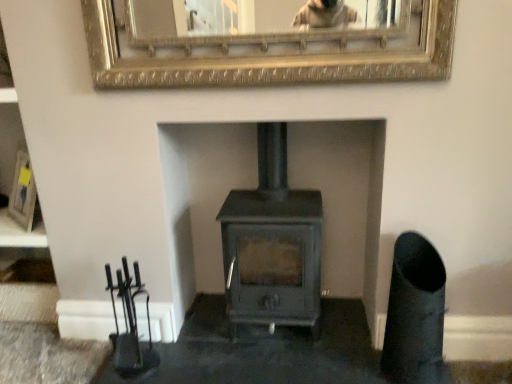
Question: Does matte black picture frame at left, the 2th picture frame positioned from the front, have a larger size compared to gold textured mirror at upper center, marked as the second picture frame in a back-to-front arrangement?

Choices:
 (A) yes
 (B) no

Answer: (B)

Question: Is matte black picture frame at left, the 2th picture frame positioned from the right, oriented towards gold textured mirror at upper center, the 2th picture frame from the left?

Choices:
 (A) no
 (B) yes

Answer: (A)

Question: From a real-world perspective, is matte black picture frame at left, the 2th picture frame positioned from the right, under gold textured mirror at upper center, the second picture frame ordered from the bottom?

Choices:
 (A) yes
 (B) no

Answer: (A)

Question: Is matte black picture frame at left, placed as the 2th picture frame when sorted from top to bottom, beside gold textured mirror at upper center, the second picture frame ordered from the bottom?

Choices:
 (A) yes
 (B) no

Answer: (B)

Question: Does matte black picture frame at left, the 2th picture frame positioned from the front, have a lesser width compared to gold textured mirror at upper center, the first picture frame viewed from the top?

Choices:
 (A) yes
 (B) no

Answer: (B)

Question: Considering the positions of matte black picture frame at left, the first picture frame in the left-to-right sequence, and gold textured mirror at upper center, which is the first picture frame from front to back, in the image, is matte black picture frame at left, the first picture frame in the left-to-right sequence, taller or shorter than gold textured mirror at upper center, which is the first picture frame from front to back,?

Choices:
 (A) short
 (B) tall

Answer: (B)

Question: Looking at their shapes, would you say matte black picture frame at left, which ranks as the 1th picture frame in back-to-front order, is wider or thinner than gold textured mirror at upper center, the first picture frame viewed from the top?

Choices:
 (A) wide
 (B) thin

Answer: (A)

Question: From a real-world perspective, is matte black picture frame at left, the first picture frame in the left-to-right sequence, positioned above or below gold textured mirror at upper center, the second picture frame ordered from the bottom?

Choices:
 (A) above
 (B) below

Answer: (B)

Question: Is matte black picture frame at left, which ranks as the 1th picture frame in back-to-front order, spatially inside gold textured mirror at upper center, which is the first picture frame from front to back, or outside of it?

Choices:
 (A) inside
 (B) outside

Answer: (B)

Question: Choose the correct answer: Is gold textured mirror at upper center, the second picture frame ordered from the bottom, inside matte black picture frame at left, the 2th picture frame positioned from the front, or outside it?

Choices:
 (A) outside
 (B) inside

Answer: (A)

Question: Is point (218, 56) closer or farther from the camera than point (25, 187)?

Choices:
 (A) farther
 (B) closer

Answer: (B)

Question: From a real-world perspective, is gold textured mirror at upper center, the first picture frame viewed from the top, positioned above or below matte black picture frame at left, the first picture frame in the left-to-right sequence?

Choices:
 (A) above
 (B) below

Answer: (A)

Question: In terms of height, does gold textured mirror at upper center, which appears as the first picture frame when viewed from the right, look taller or shorter compared to matte black picture frame at left, placed as the 2th picture frame when sorted from top to bottom?

Choices:
 (A) short
 (B) tall

Answer: (A)

Question: Is matte black picture frame at left, acting as the first picture frame starting from the bottom, inside or outside of matte gray wood burning stove at center?

Choices:
 (A) inside
 (B) outside

Answer: (B)

Question: Relative to matte gray wood burning stove at center, is matte black picture frame at left, placed as the 2th picture frame when sorted from top to bottom, in front or behind?

Choices:
 (A) behind
 (B) front

Answer: (A)